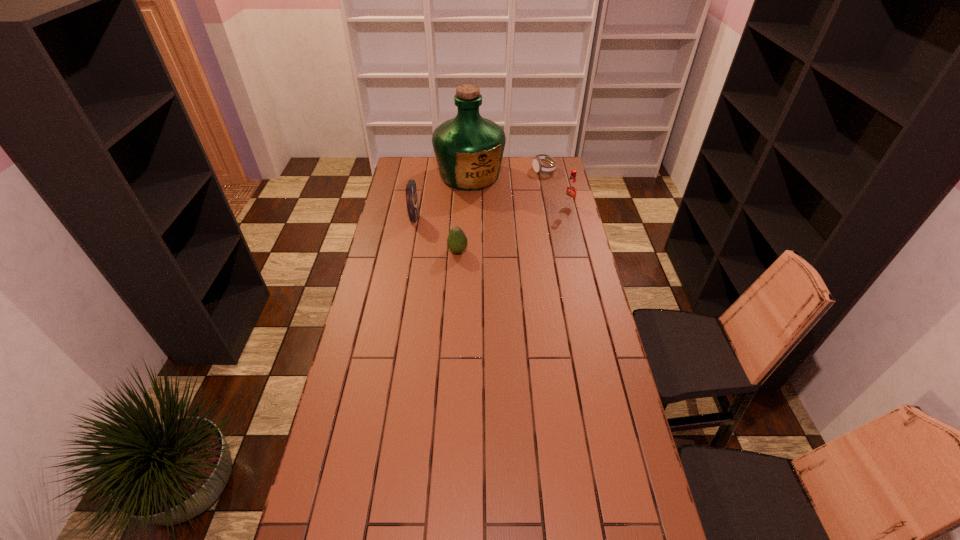
The image size is (960, 540). In order to click on blank region between the root beer and the leftmost object in this screenshot , I will do `click(492, 213)`.

Where is `unoccupied position between the liquor and the third farthest object`? The height and width of the screenshot is (540, 960). unoccupied position between the liquor and the third farthest object is located at coordinates (519, 191).

The height and width of the screenshot is (540, 960). Find the location of `vacant area between the second shortest object and the tallest object`. vacant area between the second shortest object and the tallest object is located at coordinates (464, 213).

At what (x,y) coordinates should I click in order to perform the action: click on free area in between the third farthest object and the second nearest object. Please return your answer as a coordinate pair (x, y). The width and height of the screenshot is (960, 540). Looking at the image, I should click on (492, 213).

At what (x,y) coordinates should I click in order to perform the action: click on vacant space that is in between the root beer and the liquor. Please return your answer as a coordinate pair (x, y). The image size is (960, 540). Looking at the image, I should click on (519, 191).

I want to click on vacant space that is in between the root beer and the leftmost object, so click(492, 213).

At what (x,y) coordinates should I click in order to perform the action: click on vacant space that is in between the nearest object and the shortest object. Please return your answer as a coordinate pair (x, y). Looking at the image, I should click on (500, 211).

I want to click on vacant area that lies between the watch and the tallest object, so [x=507, y=173].

At what (x,y) coordinates should I click in order to perform the action: click on vacant space that is in between the cellular telephone and the liquor. Please return your answer as a coordinate pair (x, y). Looking at the image, I should click on (442, 197).

The image size is (960, 540). What are the coordinates of `object that is the third closest one to the watch` in the screenshot? It's located at [x=411, y=190].